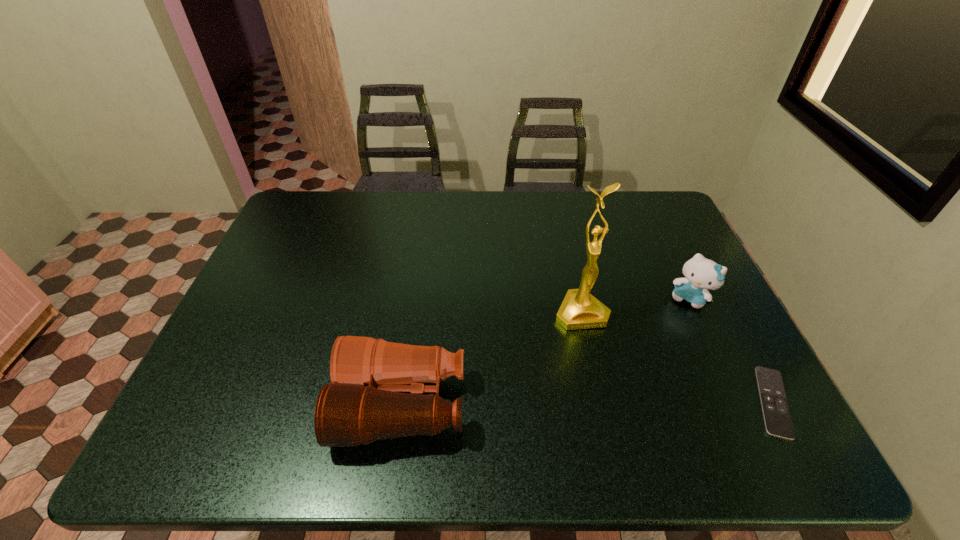
Identify the location of vacant area at the far edge of the desktop. (367, 196).

Locate an element on the screen. This screenshot has height=540, width=960. vacant space at the left edge is located at coordinates (219, 349).

This screenshot has height=540, width=960. Find the location of `free space at the right edge of the desktop`. free space at the right edge of the desktop is located at coordinates (706, 355).

At what (x,y) coordinates should I click in order to perform the action: click on free space at the far left corner. Please return your answer as a coordinate pair (x, y). Image resolution: width=960 pixels, height=540 pixels. Looking at the image, I should click on (335, 195).

Where is `vacant space at the near left corner of the desktop`? The width and height of the screenshot is (960, 540). vacant space at the near left corner of the desktop is located at coordinates (215, 403).

At what (x,y) coordinates should I click in order to perform the action: click on blank space at the near right corner of the desktop. Please return your answer as a coordinate pair (x, y). The width and height of the screenshot is (960, 540). Looking at the image, I should click on (702, 393).

This screenshot has height=540, width=960. Find the location of `free space that is in between the kitten and the remote control`. free space that is in between the kitten and the remote control is located at coordinates (732, 350).

Where is `empty location between the binoculars and the second object from left to right`? This screenshot has height=540, width=960. empty location between the binoculars and the second object from left to right is located at coordinates (492, 358).

What are the coordinates of `blank region between the tallest object and the remote control` in the screenshot? It's located at (677, 357).

Locate an element on the screen. This screenshot has height=540, width=960. blank region between the kitten and the remote control is located at coordinates (732, 350).